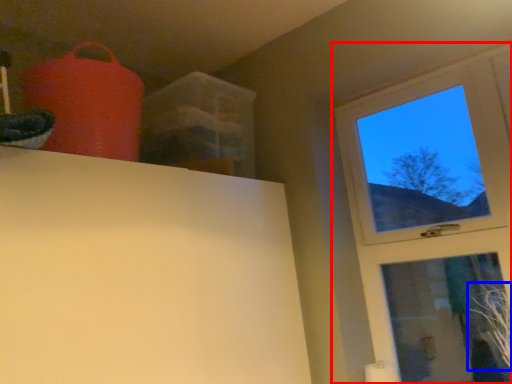
Question: Which of the following is the farthest to the observer, window (highlighted by a red box) or plant (highlighted by a blue box)?

Choices:
 (A) window
 (B) plant

Answer: (A)